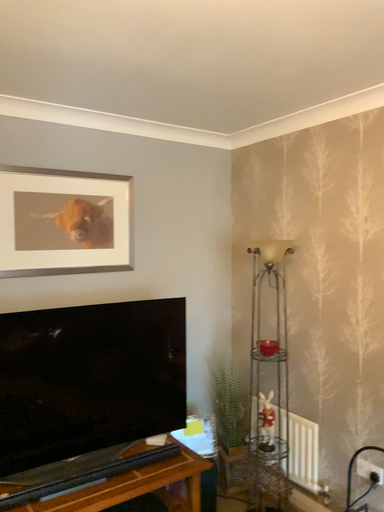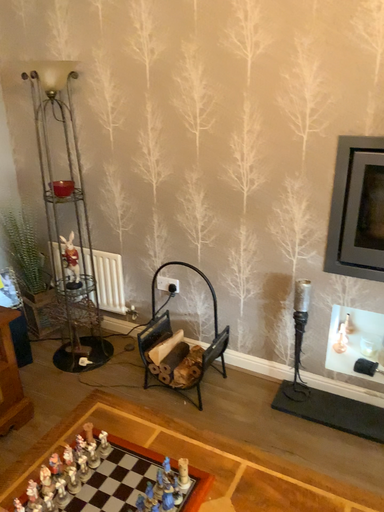
Question: Which way did the camera rotate in the video?

Choices:
 (A) rotated upward
 (B) rotated downward

Answer: (B)